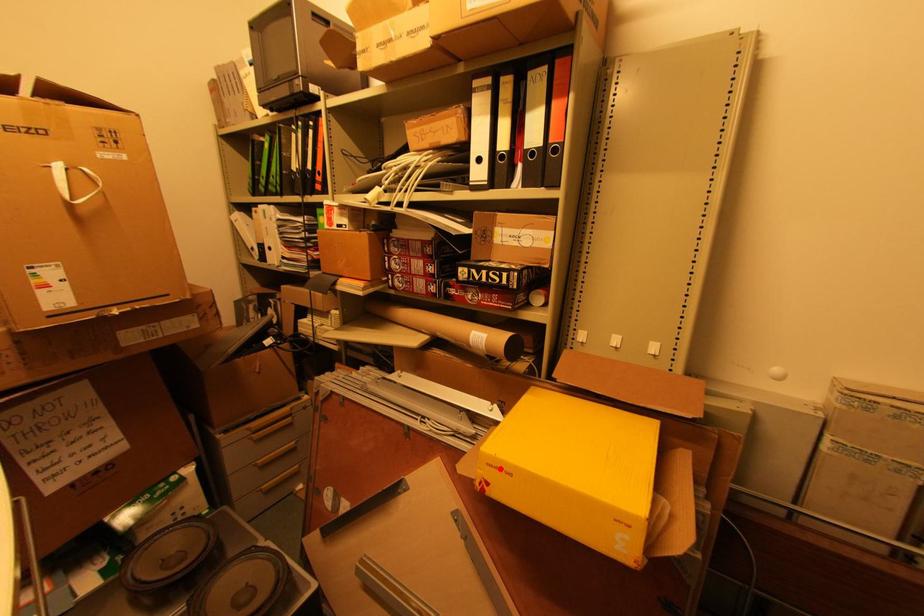
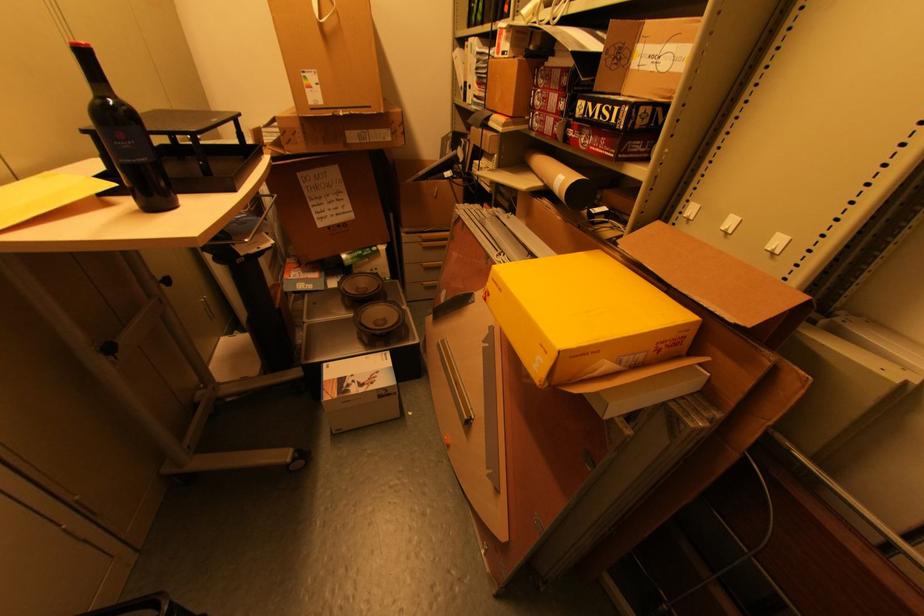
Find the pixel in the second image that matches the highlighted location in the first image.

(499, 284)